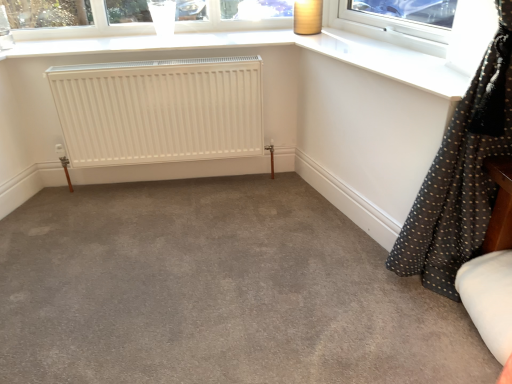
Question: From the image's perspective, is matte brown lampshade at upper right located beneath gray carpet at center?

Choices:
 (A) no
 (B) yes

Answer: (A)

Question: Does matte brown lampshade at upper right have a lesser height compared to gray carpet at center?

Choices:
 (A) yes
 (B) no

Answer: (B)

Question: Is matte brown lampshade at upper right facing away from gray carpet at center?

Choices:
 (A) no
 (B) yes

Answer: (A)

Question: Does matte brown lampshade at upper right appear on the right side of gray carpet at center?

Choices:
 (A) no
 (B) yes

Answer: (B)

Question: Is matte brown lampshade at upper right positioned far away from gray carpet at center?

Choices:
 (A) yes
 (B) no

Answer: (A)

Question: Could you tell me if matte brown lampshade at upper right is facing gray carpet at center?

Choices:
 (A) yes
 (B) no

Answer: (B)

Question: Can you confirm if clear glass window at upper center is taller than gray carpet at center?

Choices:
 (A) no
 (B) yes

Answer: (B)

Question: From the image's perspective, does clear glass window at upper center appear higher than gray carpet at center?

Choices:
 (A) yes
 (B) no

Answer: (A)

Question: From a real-world perspective, is clear glass window at upper center located higher than gray carpet at center?

Choices:
 (A) no
 (B) yes

Answer: (B)

Question: From a real-world perspective, is clear glass window at upper center under gray carpet at center?

Choices:
 (A) no
 (B) yes

Answer: (A)

Question: Considering the relative sizes of clear glass window at upper center and gray carpet at center in the image provided, is clear glass window at upper center bigger than gray carpet at center?

Choices:
 (A) yes
 (B) no

Answer: (B)

Question: Is clear glass window at upper center further to camera compared to gray carpet at center?

Choices:
 (A) no
 (B) yes

Answer: (B)

Question: From the image's perspective, is white matte radiator at center over matte brown lampshade at upper right?

Choices:
 (A) yes
 (B) no

Answer: (B)